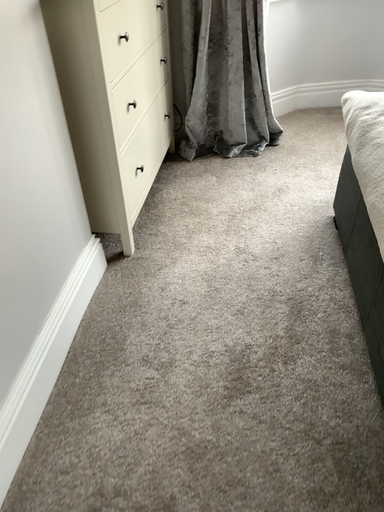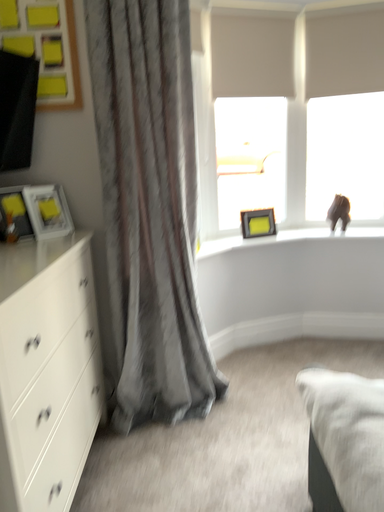
Question: Which way did the camera rotate in the video?

Choices:
 (A) rotated upward
 (B) rotated downward

Answer: (A)